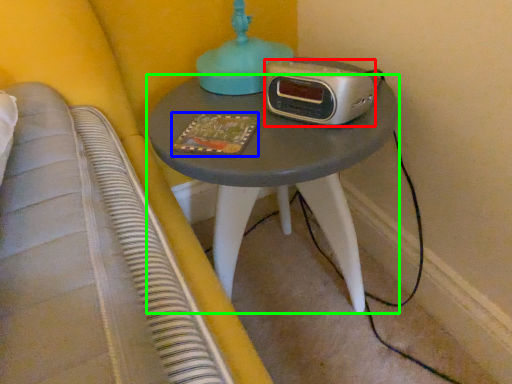
Question: Which is farther away from stereo (highlighted by a red box)? book (highlighted by a blue box) or nightstand (highlighted by a green box)?

Choices:
 (A) book
 (B) nightstand

Answer: (B)